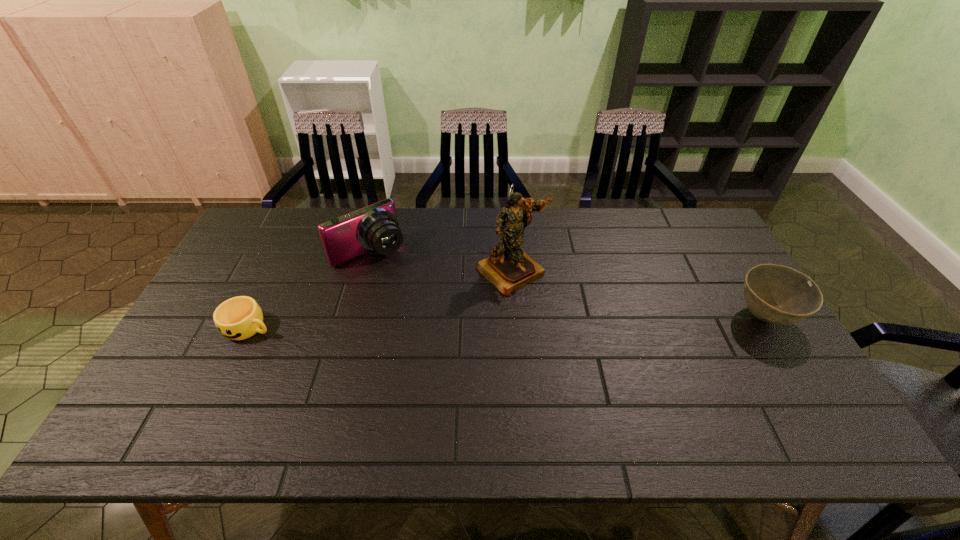
Identify the location of vacant region located on the front-facing side of the figurine. The height and width of the screenshot is (540, 960). (576, 334).

The height and width of the screenshot is (540, 960). In order to click on vacant area situated on the front-facing side of the figurine in this screenshot , I will do `click(614, 370)`.

Locate an element on the screen. vacant space situated on the front-facing side of the figurine is located at coordinates click(x=557, y=315).

Locate an element on the screen. free space located on the front-facing side of the second tallest object is located at coordinates (442, 325).

Identify the location of free space located 0.240m on the front-facing side of the second tallest object. (430, 312).

This screenshot has height=540, width=960. I want to click on free space located 0.240m on the front-facing side of the second tallest object, so click(x=430, y=312).

Locate an element on the screen. The image size is (960, 540). figurine located at the far edge is located at coordinates pos(509,268).

Identify the location of camera that is at the far edge. The image size is (960, 540). (375, 227).

At what (x,y) coordinates should I click in order to perform the action: click on object that is at the left edge. Please return your answer as a coordinate pair (x, y). Image resolution: width=960 pixels, height=540 pixels. Looking at the image, I should click on (238, 318).

The height and width of the screenshot is (540, 960). Find the location of `object situated at the right edge`. object situated at the right edge is located at coordinates (775, 294).